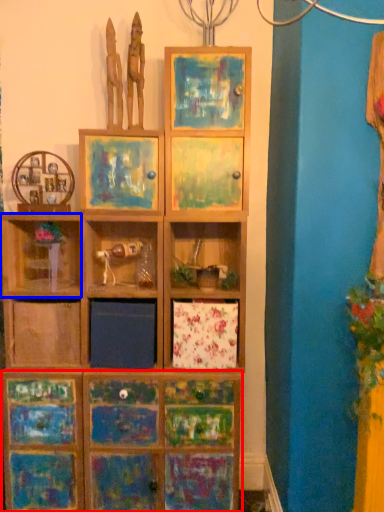
Question: Which object is further to the camera taking this photo, cabinetry (highlighted by a red box) or shelf (highlighted by a blue box)?

Choices:
 (A) cabinetry
 (B) shelf

Answer: (A)